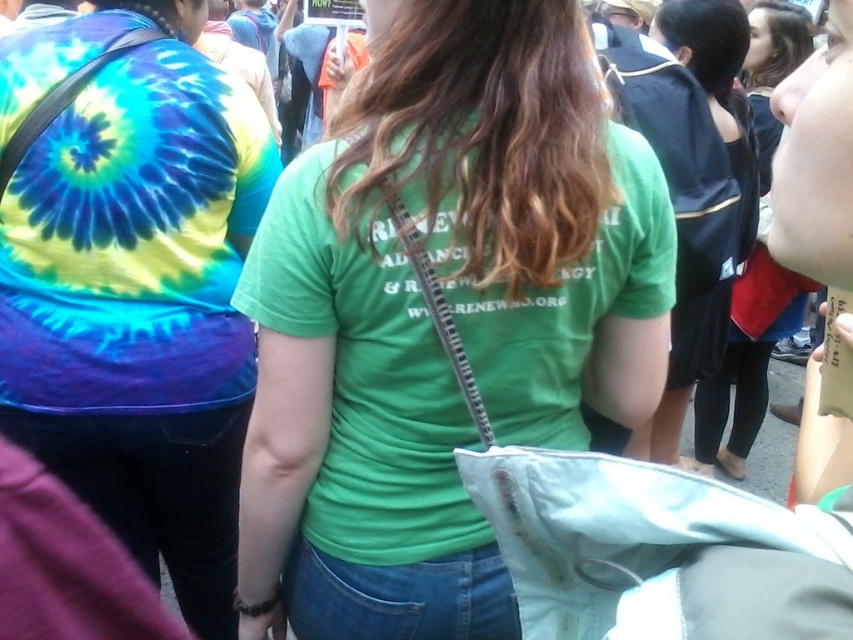
Between green matte t-shirt at center and tie-dye fabric shirt at left, which one appears on the right side from the viewer's perspective?

From the viewer's perspective, green matte t-shirt at center appears more on the right side.

Who is positioned more to the left, green matte t-shirt at center or tie-dye fabric shirt at left?

Positioned to the left is tie-dye fabric shirt at left.

Does point (618, 273) come in front of point (115, 150)?

Yes, it is in front of point (115, 150).

You are a GUI agent. You are given a task and a screenshot of the screen. Output one action in this format:
    pyautogui.click(x=<x>, y=<y>)
    Task: Click on the green matte t-shirt at center
    
    Given the screenshot: What is the action you would take?
    pyautogui.click(x=431, y=321)